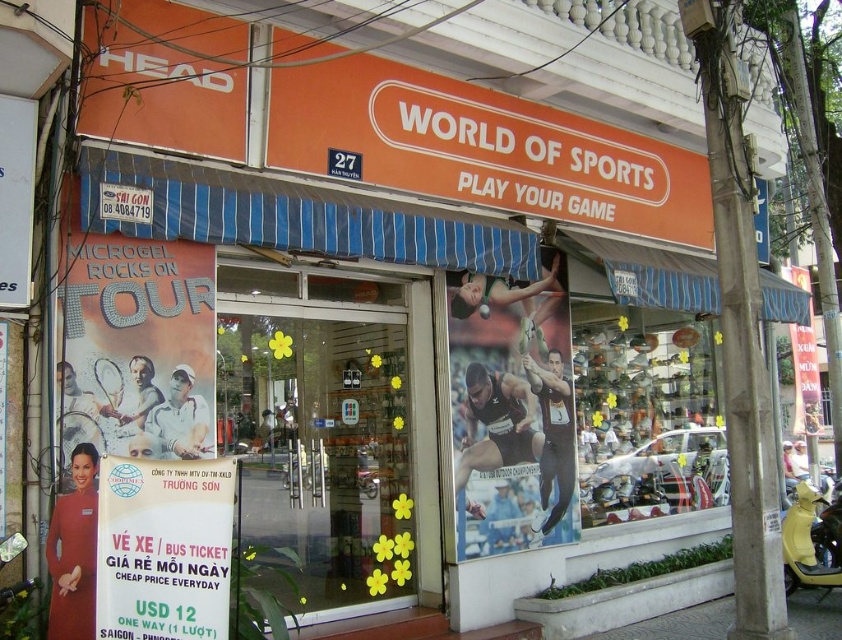
Question: Which object appears farthest from the camera in this image?

Choices:
 (A) yellow paper poster at left
 (B) transparent glass door at center
 (C) metallic silver shoes at center
 (D) white paper sign at lower left

Answer: (C)

Question: Observing the image, what is the correct spatial positioning of matte black poster at center in reference to yellow paper poster at left?

Choices:
 (A) left
 (B) right

Answer: (B)

Question: Does transparent glass door at center have a smaller size compared to yellow paper poster at left?

Choices:
 (A) yes
 (B) no

Answer: (B)

Question: Which object appears closest to the camera in this image?

Choices:
 (A) metallic silver shoes at center
 (B) transparent glass door at center
 (C) white paper sign at lower left

Answer: (C)

Question: Can you confirm if transparent glass door at center is positioned above metallic silver shoes at center?

Choices:
 (A) yes
 (B) no

Answer: (A)

Question: Which point is closer to the camera?

Choices:
 (A) transparent glass door at center
 (B) metallic silver shoes at center

Answer: (A)